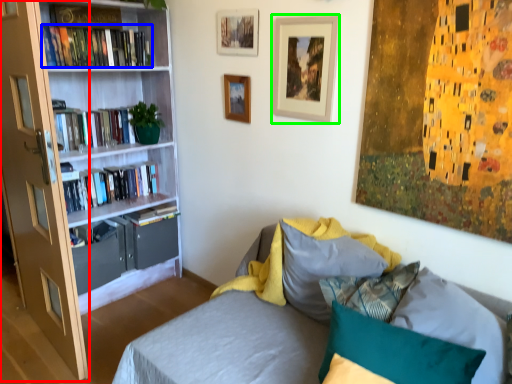
Question: Which is farther away from glass door (highlighted by a red box)? book (highlighted by a blue box) or picture frame (highlighted by a green box)?

Choices:
 (A) book
 (B) picture frame

Answer: (B)